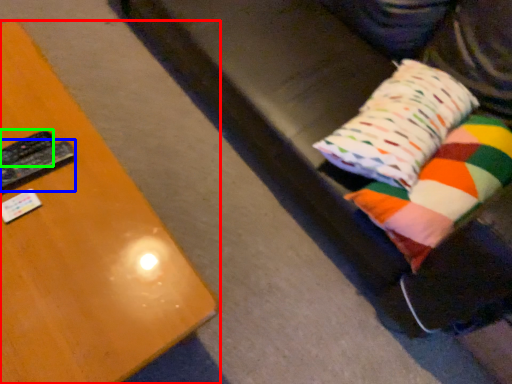
Question: Which is farther away from furniture (highlighted by a red box)? remote (highlighted by a blue box) or remote (highlighted by a green box)?

Choices:
 (A) remote
 (B) remote

Answer: (B)